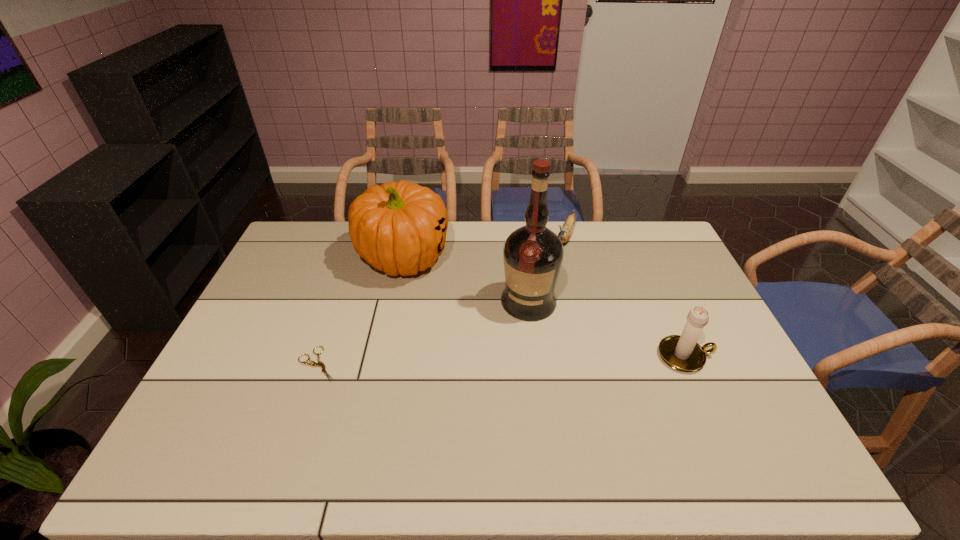
This screenshot has width=960, height=540. Find the location of `shears`. shears is located at coordinates (320, 363).

Where is `the rightmost object`? the rightmost object is located at coordinates (681, 352).

Identify the location of candle holder. This screenshot has height=540, width=960. (681, 352).

The height and width of the screenshot is (540, 960). Find the location of `the tallest object`. the tallest object is located at coordinates (533, 254).

Identify the location of the third object from left to right. The width and height of the screenshot is (960, 540). (533, 254).

Find the location of a particular element. The width and height of the screenshot is (960, 540). the second shortest object is located at coordinates (565, 234).

You are a GUI agent. You are given a task and a screenshot of the screen. Output one action in this format:
    pyautogui.click(x=<x>, y=<y>)
    Task: Click on the second object from right to left
    
    Given the screenshot: What is the action you would take?
    pos(565,234)

Find the location of a particular element. the fourth shortest object is located at coordinates (400, 227).

In order to click on free point located 0.080m on the left of the shortest object in this screenshot , I will do `click(268, 364)`.

At what (x,y) coordinates should I click in order to perform the action: click on vacant space located 0.130m on the surface of the liquor. Please return your answer as a coordinate pair (x, y). This screenshot has width=960, height=540. Looking at the image, I should click on (509, 353).